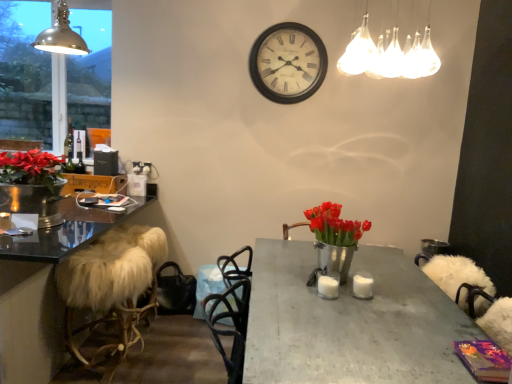
The image size is (512, 384). Describe the element at coordinates (334, 240) in the screenshot. I see `metallic vase with red flowers at center` at that location.

Find the location of a particular element. The image size is (512, 384). white matte candle at center, which appears as the 1th candle when viewed from the left is located at coordinates (328, 287).

Locate an element on the screen. This screenshot has width=512, height=384. white fur-covered stool at left is located at coordinates (44, 290).

The height and width of the screenshot is (384, 512). Identify the location of metallic vase with red flowers at center. (334, 240).

Is metallic dome lamp at upper left, placed as the 1th lamp when sorted from back to front, not near white matte clock at upper center?

Indeed, metallic dome lamp at upper left, placed as the 1th lamp when sorted from back to front, is not near white matte clock at upper center.

Considering the relative positions of metallic dome lamp at upper left, the 2th lamp in the right-to-left sequence, and white matte clock at upper center in the image provided, is metallic dome lamp at upper left, the 2th lamp in the right-to-left sequence, to the left of white matte clock at upper center from the viewer's perspective?

Yes, metallic dome lamp at upper left, the 2th lamp in the right-to-left sequence, is to the left of white matte clock at upper center.

From a real-world perspective, between metallic dome lamp at upper left, which is the 1th lamp from left to right, and white matte clock at upper center, who is vertically lower?

In real-world perspective, white matte clock at upper center is lower.

From a real-world perspective, is metallic gray table at center located higher than white matte clock at upper center?

No.

How many degrees apart are the facing directions of metallic gray table at center and white matte clock at upper center?

The facing directions of metallic gray table at center and white matte clock at upper center are 89.4 degrees apart.

The width and height of the screenshot is (512, 384). I want to click on table below the white matte clock at upper center (from the image's perspective), so click(x=351, y=322).

Which of these two, metallic gray table at center or white matte clock at upper center, is smaller?

Smaller between the two is white matte clock at upper center.

Consider the image. How different are the orientations of metallic dome lamp at upper left, which is the 2th lamp from front to back, and translucent glass light fixture at upper center, positioned as the 2th lamp in left-to-right order, in degrees?

0.00151 degrees separate the facing orientations of metallic dome lamp at upper left, which is the 2th lamp from front to back, and translucent glass light fixture at upper center, positioned as the 2th lamp in left-to-right order.

Is metallic dome lamp at upper left, the 2th lamp in the right-to-left sequence, in contact with translucent glass light fixture at upper center, positioned as the 1th lamp in right-to-left order?

There is a gap between metallic dome lamp at upper left, the 2th lamp in the right-to-left sequence, and translucent glass light fixture at upper center, positioned as the 1th lamp in right-to-left order.

Identify the location of lamp positioned vertically above the translucent glass light fixture at upper center, which is the 1th lamp from front to back (from a real-world perspective). Image resolution: width=512 pixels, height=384 pixels. (61, 35).

Considering the sizes of metallic dome lamp at upper left, which is the 2th lamp from front to back, and translucent glass light fixture at upper center, positioned as the 1th lamp in right-to-left order, in the image, is metallic dome lamp at upper left, which is the 2th lamp from front to back, wider or thinner than translucent glass light fixture at upper center, positioned as the 1th lamp in right-to-left order,?

In the image, metallic dome lamp at upper left, which is the 2th lamp from front to back, appears to be more narrow than translucent glass light fixture at upper center, positioned as the 1th lamp in right-to-left order.

Which of these two, white matte candle at center, which is the 2th candle from right to left, or translucent glass light fixture at upper center, which is counted as the second lamp, starting from the back, stands shorter?

Standing shorter between the two is white matte candle at center, which is the 2th candle from right to left.

Can you tell me how much white matte candle at center, which is the 2th candle from right to left, and translucent glass light fixture at upper center, positioned as the 1th lamp in right-to-left order, differ in facing direction?

They differ by 0.00219 degrees in their facing directions.

Based on their sizes in the image, would you say white matte candle at center, which appears as the 1th candle when viewed from the left, is bigger or smaller than translucent glass light fixture at upper center, which is the 1th lamp from front to back?

Considering their sizes, white matte candle at center, which appears as the 1th candle when viewed from the left, takes up less space than translucent glass light fixture at upper center, which is the 1th lamp from front to back.

Can you confirm if metallic glass window at upper left is wider than white matte clock at upper center?

In fact, metallic glass window at upper left might be narrower than white matte clock at upper center.

From a real-world perspective, is metallic glass window at upper left located higher than white matte clock at upper center?

No.

Is metallic glass window at upper left positioned before white matte clock at upper center?

No, it is not.

Is metallic glass window at upper left oriented away from white matte clock at upper center?

No.

In the image, is white fur-covered stool at left positioned in front of or behind metallic gray table at center?

white fur-covered stool at left is behind metallic gray table at center.

Considering the sizes of white fur-covered stool at left and metallic gray table at center in the image, is white fur-covered stool at left wider or thinner than metallic gray table at center?

Clearly, white fur-covered stool at left has less width compared to metallic gray table at center.

Can metallic gray table at center be found inside white fur-covered stool at left?

No, metallic gray table at center is not inside white fur-covered stool at left.

Find the location of a particular element. Image resolution: width=512 pixels, height=384 pixels. swivel chair below the metallic gray table at center (from a real-world perspective) is located at coordinates (112, 283).

Are metallic vase with red flowers at center and green glass bottle at left beside each other?

There is a gap between metallic vase with red flowers at center and green glass bottle at left.

Is metallic vase with red flowers at center facing away from green glass bottle at left?

That's not correct — metallic vase with red flowers at center is not looking away from green glass bottle at left.

Looking at their sizes, would you say metallic vase with red flowers at center is wider or thinner than green glass bottle at left?

Clearly, metallic vase with red flowers at center has more width compared to green glass bottle at left.

From a real-world perspective, who is located lower, metallic vase with red flowers at center or green glass bottle at left?

metallic vase with red flowers at center is physically lower.

Where is `wall clock located on the right of metallic dome lamp at upper left, the 2th lamp in the right-to-left sequence`? Image resolution: width=512 pixels, height=384 pixels. wall clock located on the right of metallic dome lamp at upper left, the 2th lamp in the right-to-left sequence is located at coordinates point(288,63).

What are the coordinates of `wall clock located on the left of metallic gray table at center` in the screenshot? It's located at (288, 63).

From the image, which object appears to be farther from white matte clock at upper center, white matte candle at table center, arranged as the 1th candle when viewed from the right, or metallic gray table at center?

Based on the image, white matte candle at table center, arranged as the 1th candle when viewed from the right, appears to be further to white matte clock at upper center.

Estimate the real-world distances between objects in this image. Which object is closer to green glass bottle at left, metallic glass window at upper left or metallic dome lamp at upper left, which is the 1th lamp from left to right?

Among the two, metallic dome lamp at upper left, which is the 1th lamp from left to right, is located nearer to green glass bottle at left.

Based on their spatial positions, is white fur-covered stool at left or metallic dome lamp at upper left, which is the 2th lamp from front to back, closer to white matte candle at center, which is the 2th candle from right to left?

white fur-covered stool at left.

Looking at this image, based on their spatial positions, is white matte candle at table center, which appears as the second candle when viewed from the left, or white fur-covered stool at left closer to green glass bottle at left?

Based on the image, white fur-covered stool at left appears to be nearer to green glass bottle at left.

Estimate the real-world distances between objects in this image. Which object is closer to white matte clock at upper center, white fur-covered stool at left or green glass bottle at left?

Among the two, white fur-covered stool at left is located nearer to white matte clock at upper center.

Looking at this image, when comparing their distances from white fur-covered stool at left, does white fur-covered stool at left or metallic gray table at center seem closer?

white fur-covered stool at left.

Based on their spatial positions, is green glass bottle at left or metallic dome lamp at upper left, placed as the 1th lamp when sorted from back to front, further from white matte candle at table center, which appears as the second candle when viewed from the left?

Among the two, metallic dome lamp at upper left, placed as the 1th lamp when sorted from back to front, is located further to white matte candle at table center, which appears as the second candle when viewed from the left.

When comparing their distances from metallic dome lamp at upper left, which is the 1th lamp from left to right, does white matte clock at upper center or white fur-covered stool at left seem closer?

The object closer to metallic dome lamp at upper left, which is the 1th lamp from left to right, is white matte clock at upper center.

I want to click on swivel chair between metallic glass window at upper left and white matte candle at table center, which appears as the second candle when viewed from the left, in the horizontal direction, so click(x=112, y=283).

This screenshot has width=512, height=384. Identify the location of desk between metallic glass window at upper left and white matte clock at upper center in the horizontal direction. (44, 290).

At what (x,y) coordinates should I click in order to perform the action: click on floral arrangement located between green glass bottle at left and metallic gray table at center in the left-right direction. Please return your answer as a coordinate pair (x, y). Image resolution: width=512 pixels, height=384 pixels. Looking at the image, I should click on (334, 240).

Locate an element on the screen. The width and height of the screenshot is (512, 384). floral arrangement between white fur-covered stool at left and white matte candle at table center, which appears as the second candle when viewed from the left is located at coordinates (334, 240).